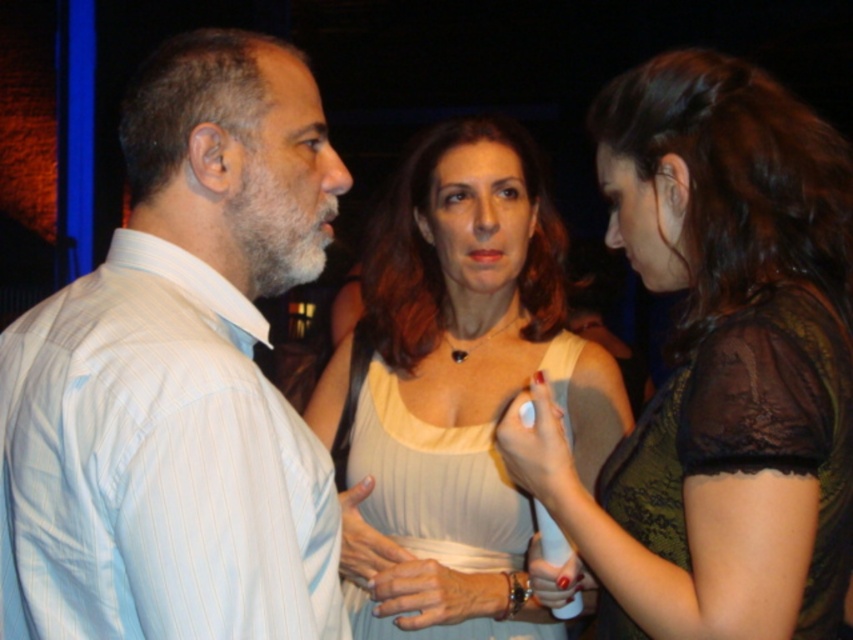
Does point (315, 225) come behind point (828, 433)?

Yes, it is.

Is white striped shirt at left closer to camera compared to matte green dress at center?

That is True.

Identify the location of white striped shirt at left. click(x=178, y=378).

The width and height of the screenshot is (853, 640). Identify the location of white striped shirt at left. (178, 378).

How much distance is there between black lace dress at right and white ribbed fabric dress at center?

black lace dress at right and white ribbed fabric dress at center are 24.26 inches apart from each other.

Is black lace dress at right smaller than white ribbed fabric dress at center?

Indeed, black lace dress at right has a smaller size compared to white ribbed fabric dress at center.

Between point (850, 408) and point (459, 468), which one is positioned behind?

Positioned behind is point (459, 468).

Find the location of a particular element. Image resolution: width=853 pixels, height=640 pixels. black lace dress at right is located at coordinates (749, 435).

Is white striped shirt at left behind white ribbed fabric dress at center?

No, white striped shirt at left is in front of white ribbed fabric dress at center.

Is point (172, 467) closer to viewer compared to point (515, 516)?

Yes, it is in front of point (515, 516).

Is point (184, 138) behind point (488, 632)?

No, it is not.

Where is `white striped shirt at left`? white striped shirt at left is located at coordinates (178, 378).